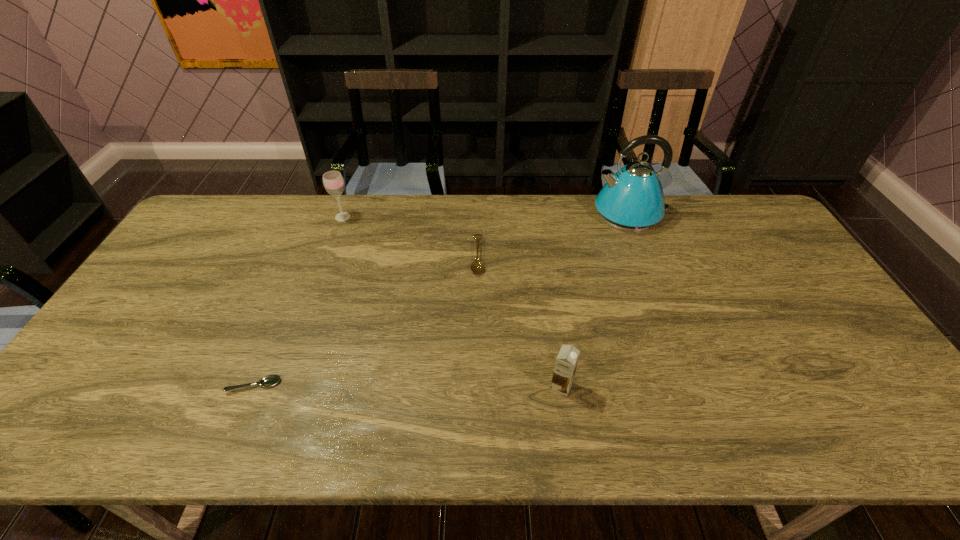
Where is `vacant space located 0.190m at the spout of the rightmost object`? vacant space located 0.190m at the spout of the rightmost object is located at coordinates (538, 214).

Image resolution: width=960 pixels, height=540 pixels. I want to click on vacant area located 0.390m on the left of the wineglass, so click(x=220, y=217).

I want to click on vacant space located on the back of the third shortest object, so click(557, 352).

At what (x,y) coordinates should I click in order to perform the action: click on free space located on the front of the second shortest object. Please return your answer as a coordinate pair (x, y). The height and width of the screenshot is (540, 960). Looking at the image, I should click on (476, 378).

Find the location of `vacant space situated 0.320m on the back of the shortest object`. vacant space situated 0.320m on the back of the shortest object is located at coordinates (297, 282).

The height and width of the screenshot is (540, 960). Identify the location of kettle at the far edge. (632, 200).

This screenshot has height=540, width=960. What are the coordinates of `wineglass located at the far edge` in the screenshot? It's located at (333, 182).

At what (x,y) coordinates should I click in order to perform the action: click on ladle located at the far edge. Please return your answer as a coordinate pair (x, y). The image size is (960, 540). Looking at the image, I should click on (477, 267).

I want to click on free space at the far edge, so click(x=550, y=226).

The width and height of the screenshot is (960, 540). Find the location of `vacant space at the far left corner of the desktop`. vacant space at the far left corner of the desktop is located at coordinates (238, 221).